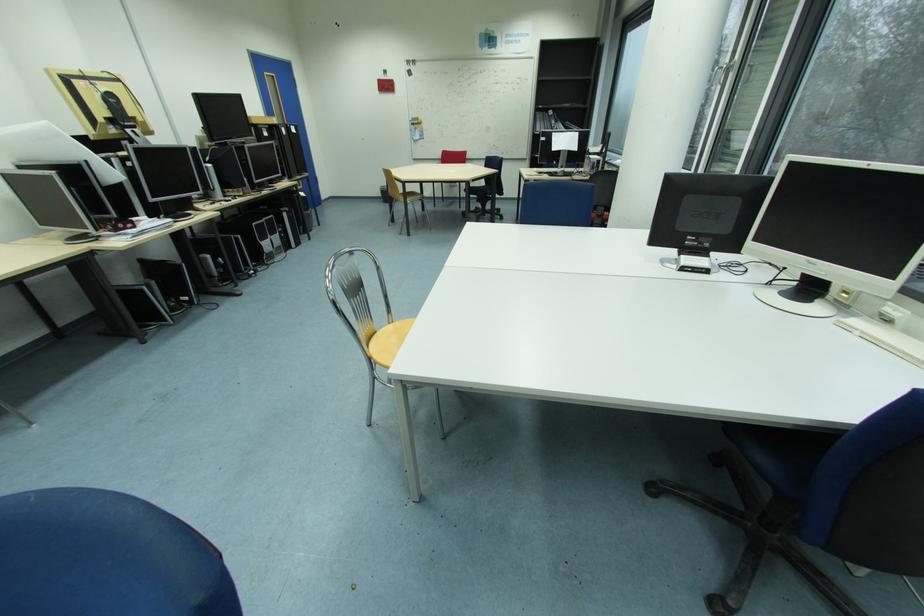
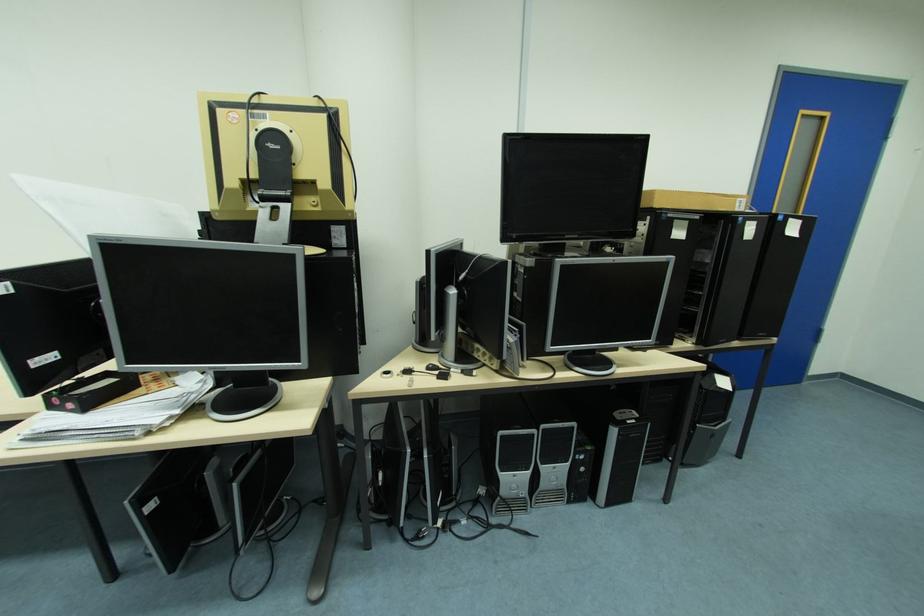
Find the pixel in the second image that matches (x=293, y=215) in the first image.

(621, 432)